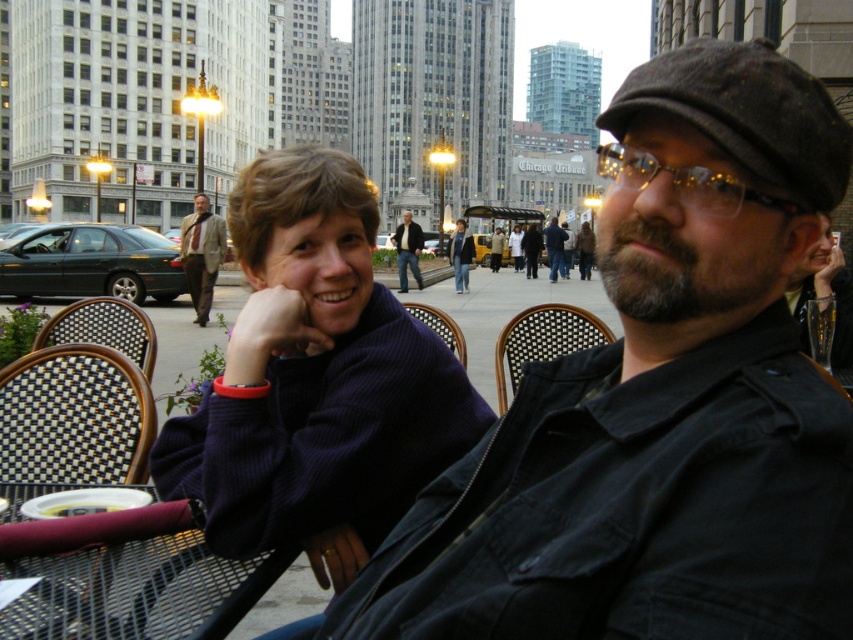
Question: Does light brown suit at center have a greater width compared to matte black jacket at center?

Choices:
 (A) yes
 (B) no

Answer: (B)

Question: Among these points, which one is farthest from the camera?

Choices:
 (A) (45, 566)
 (B) (544, 548)
 (C) (548, 243)
 (D) (393, 241)

Answer: (C)

Question: Estimate the real-world distances between objects in this image. Which object is farther from the dark blue jeans at center?

Choices:
 (A) purple fleece sweater at center
 (B) light brown suit at center

Answer: (A)

Question: Which point is closer to the camera?

Choices:
 (A) matte black jacket at center
 (B) dark blue jeans at center

Answer: (B)

Question: Is black matte glass at upper right to the right of jeans at center from the viewer's perspective?

Choices:
 (A) no
 (B) yes

Answer: (B)

Question: Is matte black jacket at center to the right of jeans at center from the viewer's perspective?

Choices:
 (A) no
 (B) yes

Answer: (B)